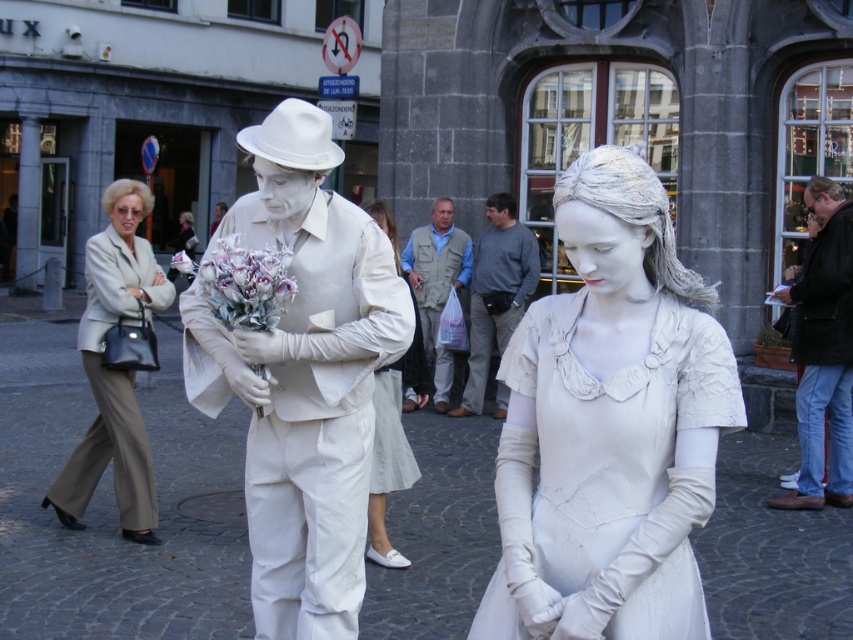
Question: Does white matte sculpture at center have a greater width compared to white painted statue at right?

Choices:
 (A) no
 (B) yes

Answer: (B)

Question: Which point appears farthest from the camera in this image?

Choices:
 (A) (444, 301)
 (B) (91, 490)

Answer: (A)

Question: Which of these objects is positioned closest to the matte gray vest at center?

Choices:
 (A) light beige fabric pants at left
 (B) white fabric skirt at center

Answer: (B)

Question: Among these points, which one is farthest from the camera?

Choices:
 (A) (844, 467)
 (B) (492, 282)
 (C) (363, 257)
 (D) (682, 406)

Answer: (B)

Question: Is white fabric dress at center smaller than purple silk bouquet at center?

Choices:
 (A) yes
 (B) no

Answer: (B)

Question: Is white fabric dress at center to the right of white fabric skirt at center from the viewer's perspective?

Choices:
 (A) no
 (B) yes

Answer: (B)